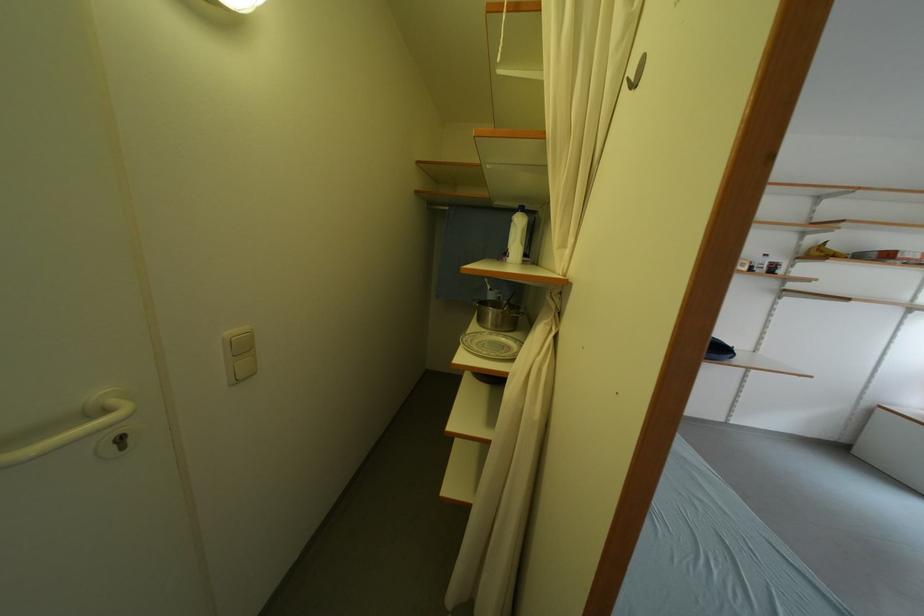
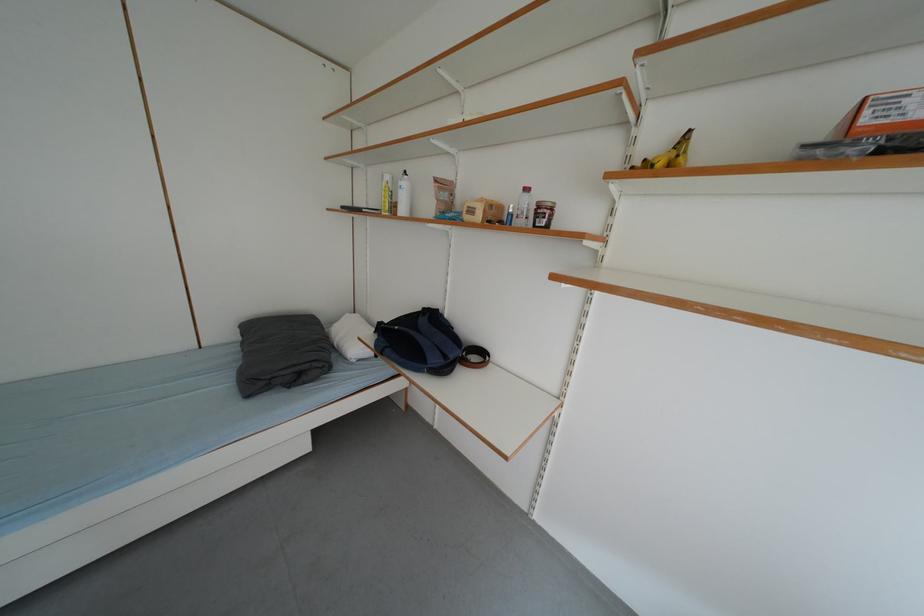
In the second image, find the point that corresponds to (x=755, y=272) in the first image.

(487, 220)